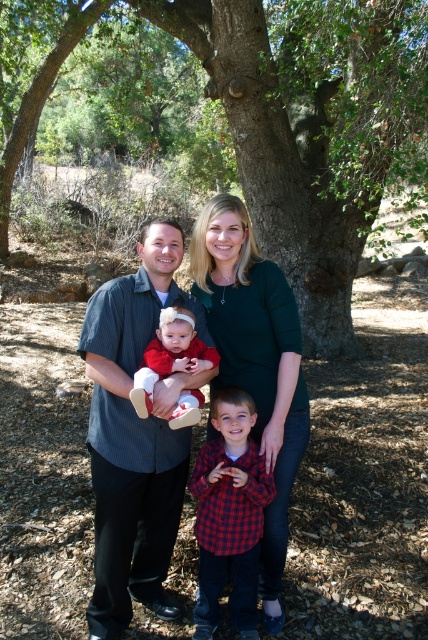
Does green matte shirt at center have a greater height compared to matte red dress at center?

Correct, green matte shirt at center is much taller as matte red dress at center.

At what (x,y) coordinates should I click in order to perform the action: click on green matte shirt at center. Please return your answer as a coordinate pair (x, y). The image size is (428, 640). Looking at the image, I should click on (255, 362).

Is point (335, 140) closer to viewer compared to point (124, 484)?

No, it is behind (124, 484).

Which is above, green leafy tree at center or dark gray shirt at center?

green leafy tree at center is above.

You are a GUI agent. You are given a task and a screenshot of the screen. Output one action in this format:
    pyautogui.click(x=<x>, y=<y>)
    Task: Click on the green leafy tree at center
    
    Given the screenshot: What is the action you would take?
    point(312,129)

Does green leafy tree at center have a lesser width compared to red plaid shirt at center?

No, green leafy tree at center is not thinner than red plaid shirt at center.

Can you confirm if green leafy tree at center is taller than red plaid shirt at center?

Yes.

In order to click on green leafy tree at center in this screenshot , I will do `click(312, 129)`.